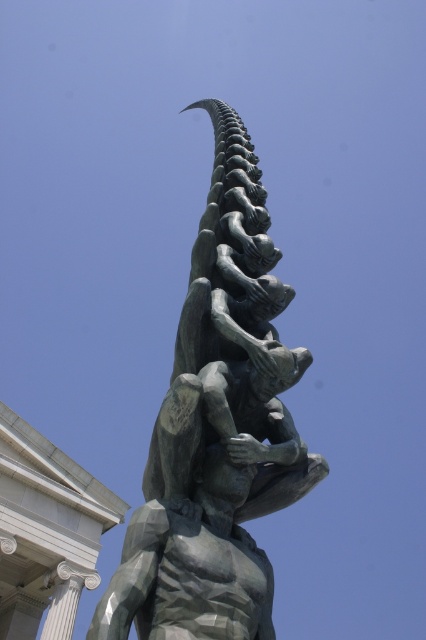
The height and width of the screenshot is (640, 426). Describe the element at coordinates (216, 429) in the screenshot. I see `bronze textured sculpture at center` at that location.

Can you confirm if bronze textured sculpture at center is positioned below polished bronze statue at center?

No, bronze textured sculpture at center is not below polished bronze statue at center.

Consider the image. Who is more forward, (259, 468) or (193, 561)?

Positioned in front is point (193, 561).

Where is `bronze textured sculpture at center`? bronze textured sculpture at center is located at coordinates (216, 429).